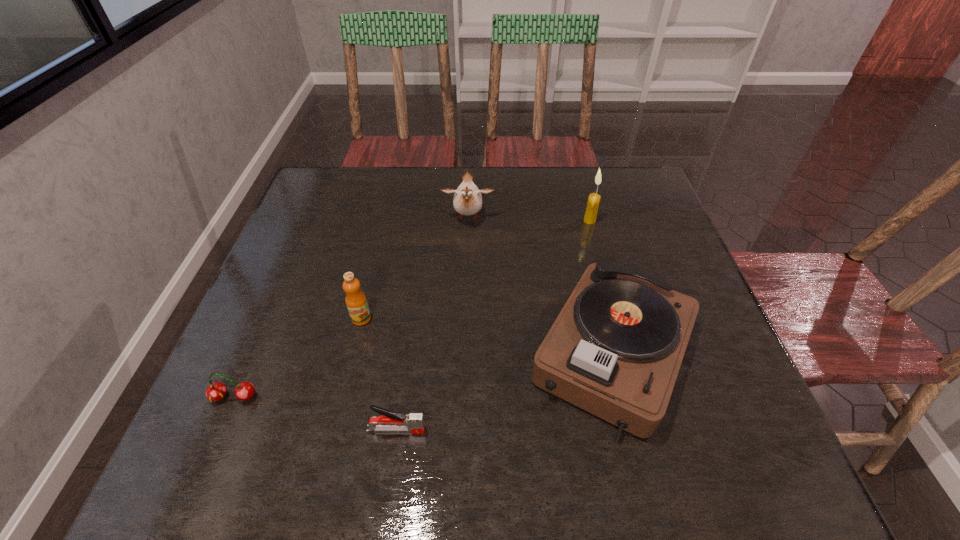
I want to click on vacant point located between the bird and the orange juice, so click(415, 268).

Locate an element on the screen. The image size is (960, 540). empty space between the orange juice and the stapler is located at coordinates (379, 374).

Where is `free spot between the fifth object from right to left and the leftmost object`? free spot between the fifth object from right to left and the leftmost object is located at coordinates (298, 357).

Where is `free space between the leftmost object and the tallest object`? This screenshot has height=540, width=960. free space between the leftmost object and the tallest object is located at coordinates (412, 309).

At what (x,y) coordinates should I click in order to perform the action: click on object that is the fifth closest one to the candle. Please return your answer as a coordinate pair (x, y). The image size is (960, 540). Looking at the image, I should click on (216, 391).

Locate an element on the screen. The image size is (960, 540). the fourth closest object to the candle is located at coordinates (390, 421).

Locate an element on the screen. vacant space that satisfies the following two spatial constraints: 1. at the beak of the bird; 2. on the handle side of the stapler is located at coordinates (462, 430).